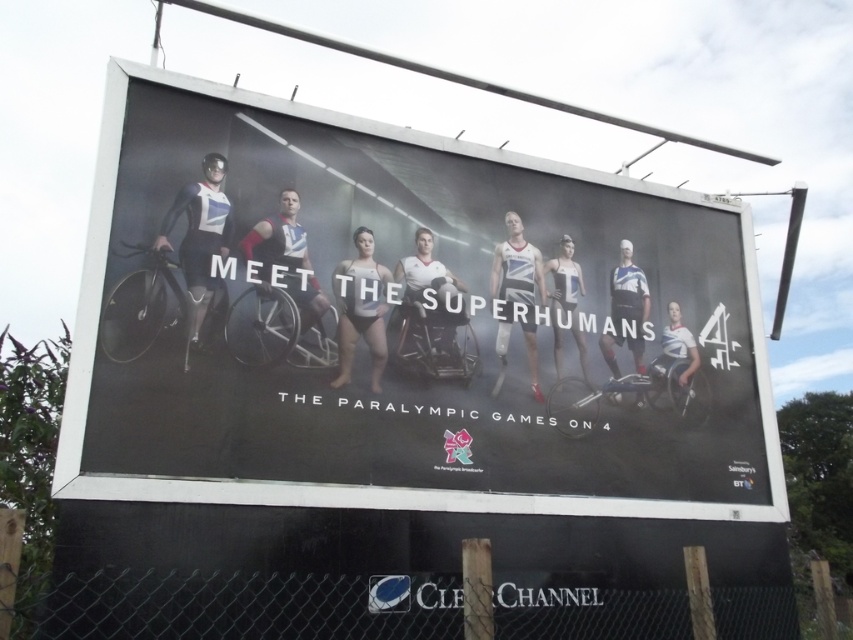
This screenshot has width=853, height=640. What do you see at coordinates (404, 323) in the screenshot?
I see `matte black billboard at center` at bounding box center [404, 323].

The image size is (853, 640). In order to click on matte black billboard at center in this screenshot , I will do `click(404, 323)`.